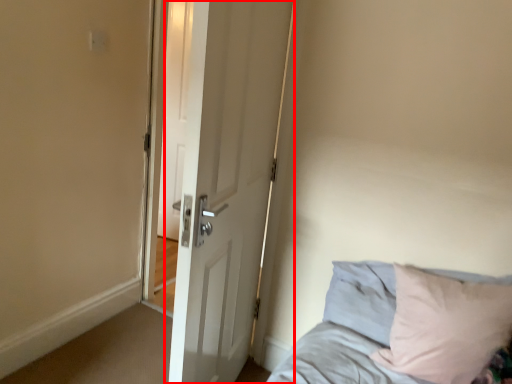
Question: From the image's perspective, what is the correct spatial relationship of door (annotated by the red box) in relation to bed?

Choices:
 (A) above
 (B) below

Answer: (A)